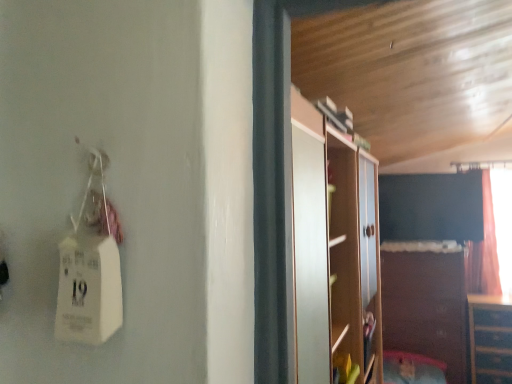
Describe the element at coordinates (490, 339) in the screenshot. Image resolution: width=512 pixels, height=384 pixels. I see `wooden dresser at lower right, which appears as the first cabinetry when viewed from the right` at that location.

I want to click on wooden dresser at lower right, the second cabinetry when ordered from left to right, so click(x=490, y=339).

How much space does wooden dresser at lower right, which appears as the first cabinetry when viewed from the right, occupy vertically?

wooden dresser at lower right, which appears as the first cabinetry when viewed from the right, is 33.66 inches tall.

What is the approximate height of brown matte cabinet at lower right, marked as the first cabinetry in a left-to-right arrangement?

brown matte cabinet at lower right, marked as the first cabinetry in a left-to-right arrangement, is 4.30 feet in height.

The width and height of the screenshot is (512, 384). Identify the location of brown matte cabinet at lower right, which is the 2th cabinetry from right to left. (426, 303).

Describe the element at coordinates (426, 303) in the screenshot. I see `brown matte cabinet at lower right, marked as the first cabinetry in a left-to-right arrangement` at that location.

You are a GUI agent. You are given a task and a screenshot of the screen. Output one action in this format:
    pyautogui.click(x=<x>, y=<y>)
    Task: Click on the wooden dresser at lower right, which appears as the first cabinetry when viewed from the right
    Image resolution: width=512 pixels, height=384 pixels.
    Given the screenshot: What is the action you would take?
    pyautogui.click(x=490, y=339)

Based on the photo, between brown matte cabinet at lower right, marked as the first cabinetry in a left-to-right arrangement, and wooden dresser at lower right, the second cabinetry when ordered from left to right, which one appears on the right side from the viewer's perspective?

From the viewer's perspective, wooden dresser at lower right, the second cabinetry when ordered from left to right, appears more on the right side.

Does brown matte cabinet at lower right, marked as the first cabinetry in a left-to-right arrangement, come behind wooden dresser at lower right, the second cabinetry when ordered from left to right?

Yes, brown matte cabinet at lower right, marked as the first cabinetry in a left-to-right arrangement, is further from the viewer.

Is point (387, 305) closer or farther from the camera than point (499, 311)?

Point (387, 305) appears to be farther away from the viewer than point (499, 311).

From the image's perspective, is brown matte cabinet at lower right, which is the 2th cabinetry from right to left, beneath wooden dresser at lower right, the second cabinetry when ordered from left to right?

Incorrect, from the image's perspective, brown matte cabinet at lower right, which is the 2th cabinetry from right to left, is higher than wooden dresser at lower right, the second cabinetry when ordered from left to right.

From a real-world perspective, which is physically above, brown matte cabinet at lower right, marked as the first cabinetry in a left-to-right arrangement, or wooden dresser at lower right, the second cabinetry when ordered from left to right?

In real-world perspective, brown matte cabinet at lower right, marked as the first cabinetry in a left-to-right arrangement, is above.

Which object is thinner, brown matte cabinet at lower right, marked as the first cabinetry in a left-to-right arrangement, or wooden dresser at lower right, which appears as the first cabinetry when viewed from the right?

With smaller width is wooden dresser at lower right, which appears as the first cabinetry when viewed from the right.

Considering the sizes of objects brown matte cabinet at lower right, which is the 2th cabinetry from right to left, and wooden dresser at lower right, which appears as the first cabinetry when viewed from the right, in the image provided, who is shorter, brown matte cabinet at lower right, which is the 2th cabinetry from right to left, or wooden dresser at lower right, which appears as the first cabinetry when viewed from the right,?

Standing shorter between the two is wooden dresser at lower right, which appears as the first cabinetry when viewed from the right.

Can you confirm if brown matte cabinet at lower right, marked as the first cabinetry in a left-to-right arrangement, is smaller than wooden dresser at lower right, the second cabinetry when ordered from left to right?

Incorrect, brown matte cabinet at lower right, marked as the first cabinetry in a left-to-right arrangement, is not smaller in size than wooden dresser at lower right, the second cabinetry when ordered from left to right.

Is brown matte cabinet at lower right, marked as the first cabinetry in a left-to-right arrangement, outside of wooden dresser at lower right, which appears as the first cabinetry when viewed from the right?

Yes, brown matte cabinet at lower right, marked as the first cabinetry in a left-to-right arrangement, is outside of wooden dresser at lower right, which appears as the first cabinetry when viewed from the right.

Is brown matte cabinet at lower right, which is the 2th cabinetry from right to left, next to wooden dresser at lower right, which appears as the first cabinetry when viewed from the right, and touching it?

No, brown matte cabinet at lower right, which is the 2th cabinetry from right to left, is not in contact with wooden dresser at lower right, which appears as the first cabinetry when viewed from the right.

Is wooden dresser at lower right, the second cabinetry when ordered from left to right, at the back of brown matte cabinet at lower right, marked as the first cabinetry in a left-to-right arrangement?

That's not correct — brown matte cabinet at lower right, marked as the first cabinetry in a left-to-right arrangement, is not looking away from wooden dresser at lower right, the second cabinetry when ordered from left to right.

How far apart are brown matte cabinet at lower right, which is the 2th cabinetry from right to left, and wooden dresser at lower right, the second cabinetry when ordered from left to right?

12.40 inches.

I want to click on cabinetry above the wooden dresser at lower right, the second cabinetry when ordered from left to right (from a real-world perspective), so click(426, 303).

Visually, is wooden dresser at lower right, which appears as the first cabinetry when viewed from the right, positioned to the left or to the right of brown matte cabinet at lower right, which is the 2th cabinetry from right to left?

In the image, wooden dresser at lower right, which appears as the first cabinetry when viewed from the right, appears on the right side of brown matte cabinet at lower right, which is the 2th cabinetry from right to left.

Is wooden dresser at lower right, the second cabinetry when ordered from left to right, positioned in front of brown matte cabinet at lower right, marked as the first cabinetry in a left-to-right arrangement?

Yes, wooden dresser at lower right, the second cabinetry when ordered from left to right, is closer to the viewer.

Which is behind, point (487, 351) or point (394, 243)?

The point (394, 243) is more distant.

From the image's perspective, is wooden dresser at lower right, the second cabinetry when ordered from left to right, under brown matte cabinet at lower right, marked as the first cabinetry in a left-to-right arrangement?

Yes, from the image's perspective, wooden dresser at lower right, the second cabinetry when ordered from left to right, is below brown matte cabinet at lower right, marked as the first cabinetry in a left-to-right arrangement.

From a real-world perspective, who is located higher, wooden dresser at lower right, the second cabinetry when ordered from left to right, or brown matte cabinet at lower right, which is the 2th cabinetry from right to left?

brown matte cabinet at lower right, which is the 2th cabinetry from right to left, from a real-world perspective.

Considering the sizes of wooden dresser at lower right, which appears as the first cabinetry when viewed from the right, and brown matte cabinet at lower right, marked as the first cabinetry in a left-to-right arrangement, in the image, is wooden dresser at lower right, which appears as the first cabinetry when viewed from the right, wider or thinner than brown matte cabinet at lower right, marked as the first cabinetry in a left-to-right arrangement,?

wooden dresser at lower right, which appears as the first cabinetry when viewed from the right, is thinner than brown matte cabinet at lower right, marked as the first cabinetry in a left-to-right arrangement.

In the scene shown: Considering the relative sizes of wooden dresser at lower right, the second cabinetry when ordered from left to right, and brown matte cabinet at lower right, which is the 2th cabinetry from right to left, in the image provided, is wooden dresser at lower right, the second cabinetry when ordered from left to right, shorter than brown matte cabinet at lower right, which is the 2th cabinetry from right to left,?

Correct, wooden dresser at lower right, the second cabinetry when ordered from left to right, is not as tall as brown matte cabinet at lower right, which is the 2th cabinetry from right to left.

Is wooden dresser at lower right, which appears as the first cabinetry when viewed from the right, bigger than brown matte cabinet at lower right, which is the 2th cabinetry from right to left?

Incorrect, wooden dresser at lower right, which appears as the first cabinetry when viewed from the right, is not larger than brown matte cabinet at lower right, which is the 2th cabinetry from right to left.

Is wooden dresser at lower right, the second cabinetry when ordered from left to right, outside of brown matte cabinet at lower right, which is the 2th cabinetry from right to left?

Yes, wooden dresser at lower right, the second cabinetry when ordered from left to right, is located beyond the bounds of brown matte cabinet at lower right, which is the 2th cabinetry from right to left.

Are wooden dresser at lower right, the second cabinetry when ordered from left to right, and brown matte cabinet at lower right, marked as the first cabinetry in a left-to-right arrangement, making contact?

No.

Is wooden dresser at lower right, the second cabinetry when ordered from left to right, looking in the opposite direction of brown matte cabinet at lower right, which is the 2th cabinetry from right to left?

wooden dresser at lower right, the second cabinetry when ordered from left to right, is not turned away from brown matte cabinet at lower right, which is the 2th cabinetry from right to left.

What's the angular difference between wooden dresser at lower right, the second cabinetry when ordered from left to right, and brown matte cabinet at lower right, which is the 2th cabinetry from right to left,'s facing directions?

The angle between the facing direction of wooden dresser at lower right, the second cabinetry when ordered from left to right, and the facing direction of brown matte cabinet at lower right, which is the 2th cabinetry from right to left, is 3.62 degrees.

Measure the distance from wooden dresser at lower right, the second cabinetry when ordered from left to right, to brown matte cabinet at lower right, which is the 2th cabinetry from right to left.

The distance of wooden dresser at lower right, the second cabinetry when ordered from left to right, from brown matte cabinet at lower right, which is the 2th cabinetry from right to left, is 31.50 centimeters.

Where is `cabinetry above the wooden dresser at lower right, which appears as the first cabinetry when viewed from the right (from the image's perspective)`? The height and width of the screenshot is (384, 512). cabinetry above the wooden dresser at lower right, which appears as the first cabinetry when viewed from the right (from the image's perspective) is located at coordinates (426, 303).

Identify the location of cabinetry to the left of wooden dresser at lower right, the second cabinetry when ordered from left to right. This screenshot has height=384, width=512. (426, 303).

Image resolution: width=512 pixels, height=384 pixels. Find the location of `cabinetry below the brown matte cabinet at lower right, which is the 2th cabinetry from right to left (from a real-world perspective)`. cabinetry below the brown matte cabinet at lower right, which is the 2th cabinetry from right to left (from a real-world perspective) is located at coordinates (490, 339).